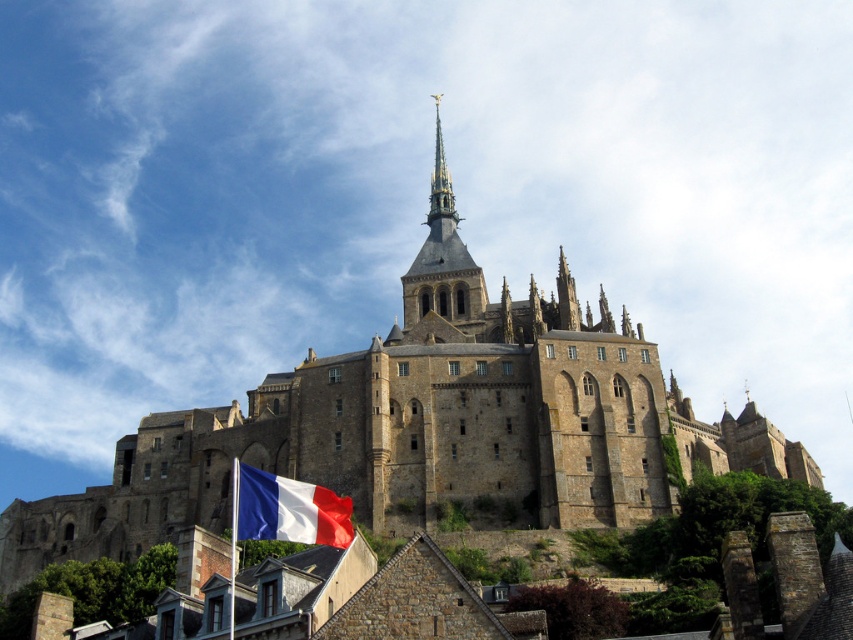
Between golden stone spire at upper center and polyester french flag at lower left, which one is positioned lower?

polyester french flag at lower left is lower down.

Identify the location of golden stone spire at upper center. The image size is (853, 640). (444, 260).

Where is `golden stone spire at upper center`? golden stone spire at upper center is located at coordinates (444, 260).